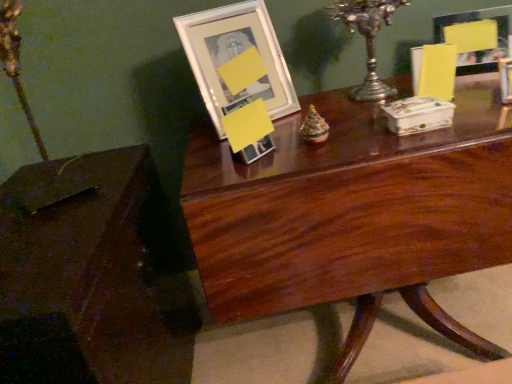
The image size is (512, 384). I want to click on free space to the left of silver metallic candle holder at upper center, so click(317, 107).